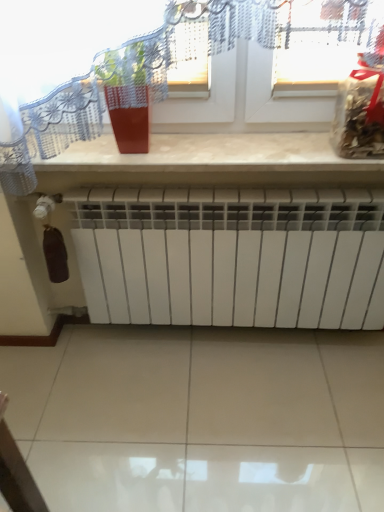
The image size is (384, 512). What are the coordinates of `free space above white matte radiator at lower center (from a real-world perspective)` in the screenshot? It's located at (217, 185).